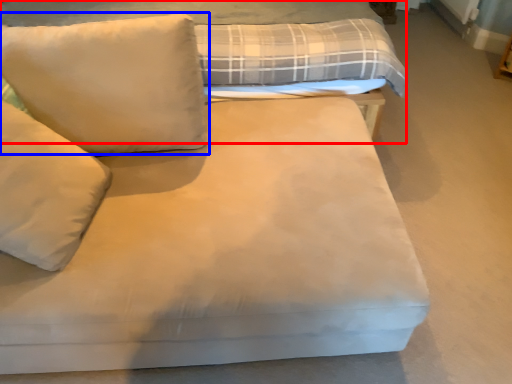
Question: Which point is closer to the camera, bed (highlighted by a red box) or pillow (highlighted by a blue box)?

Choices:
 (A) bed
 (B) pillow

Answer: (B)